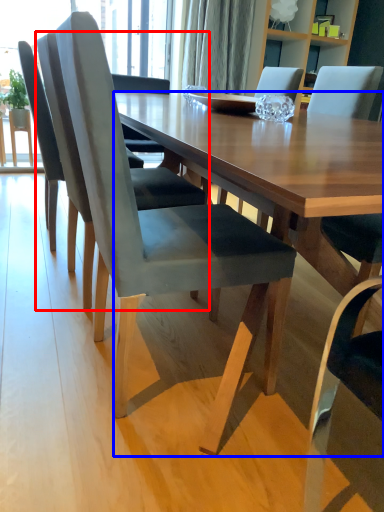
Question: Among these objects, which one is nearest to the camera, chair (highlighted by a red box) or desk (highlighted by a blue box)?

Choices:
 (A) chair
 (B) desk

Answer: (B)